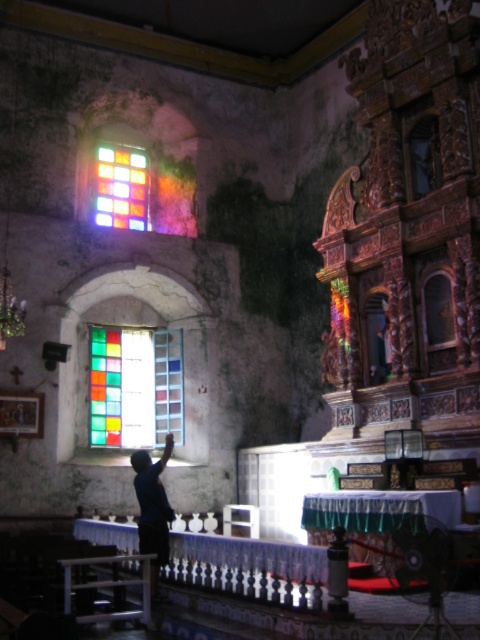
Image resolution: width=480 pixels, height=640 pixels. I want to click on stained glass window at center, so click(x=135, y=387).

What do you see at coordinates (135, 387) in the screenshot?
I see `stained glass window at center` at bounding box center [135, 387].

Who is more distant from viewer, [90,332] or [135,209]?

The point [135,209] is more distant.

Where is `stained glass window at center`? Image resolution: width=480 pixels, height=640 pixels. stained glass window at center is located at coordinates (135, 387).

Who is positioned more to the right, stained glass window at upper left or dark blue shirt at center?

From the viewer's perspective, dark blue shirt at center appears more on the right side.

Describe the element at coordinates (121, 188) in the screenshot. I see `stained glass window at upper left` at that location.

Is point (121, 168) positioned behind point (168, 435)?

Yes, it is.

You are a GUI agent. You are given a task and a screenshot of the screen. Output one action in this format:
    pyautogui.click(x=<x>, y=<y>)
    Task: Click on the stained glass window at upper left
    The height and width of the screenshot is (640, 480).
    Given the screenshot: What is the action you would take?
    pyautogui.click(x=121, y=188)

Measure the distance from stained glass window at center to dark blue shirt at center.

6.69 meters

Who is more distant from viewer, (142, 339) or (163, 509)?

Positioned behind is point (142, 339).

The height and width of the screenshot is (640, 480). I want to click on stained glass window at center, so click(x=135, y=387).